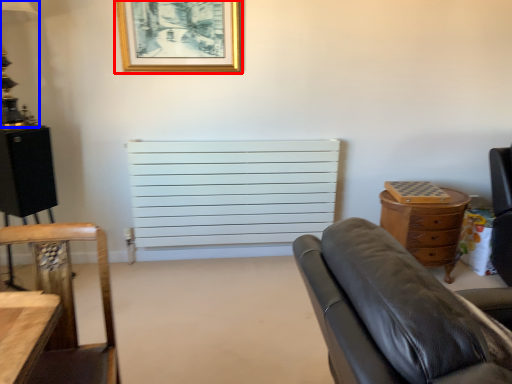
Question: Which point is further to the camera, picture frame (highlighted by a red box) or lamp (highlighted by a blue box)?

Choices:
 (A) picture frame
 (B) lamp

Answer: (A)